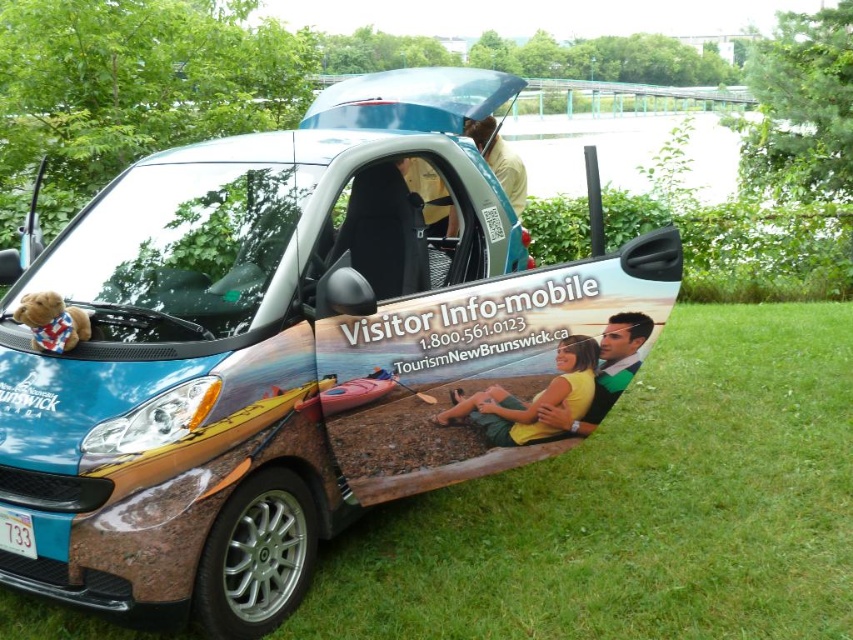
Question: Estimate the real-world distances between objects in this image. Which object is closer to the yellow matte shirt at lower center?

Choices:
 (A) metallic blue car at center
 (B) light brown leather jacket at upper center

Answer: (A)

Question: Which object appears farthest from the camera in this image?

Choices:
 (A) yellow matte shirt at lower center
 (B) metallic blue car at center

Answer: (A)

Question: Does metallic blue car at center have a greater width compared to yellow matte shirt at lower center?

Choices:
 (A) no
 (B) yes

Answer: (B)

Question: Is yellow matte shirt at lower center positioned at the back of light brown leather jacket at upper center?

Choices:
 (A) no
 (B) yes

Answer: (A)

Question: Considering the real-world distances, which object is closest to the metallic blue car at center?

Choices:
 (A) yellow matte shirt at lower center
 (B) light brown leather jacket at upper center

Answer: (A)

Question: Can you confirm if metallic blue car at center is positioned to the right of yellow matte shirt at lower center?

Choices:
 (A) no
 (B) yes

Answer: (A)